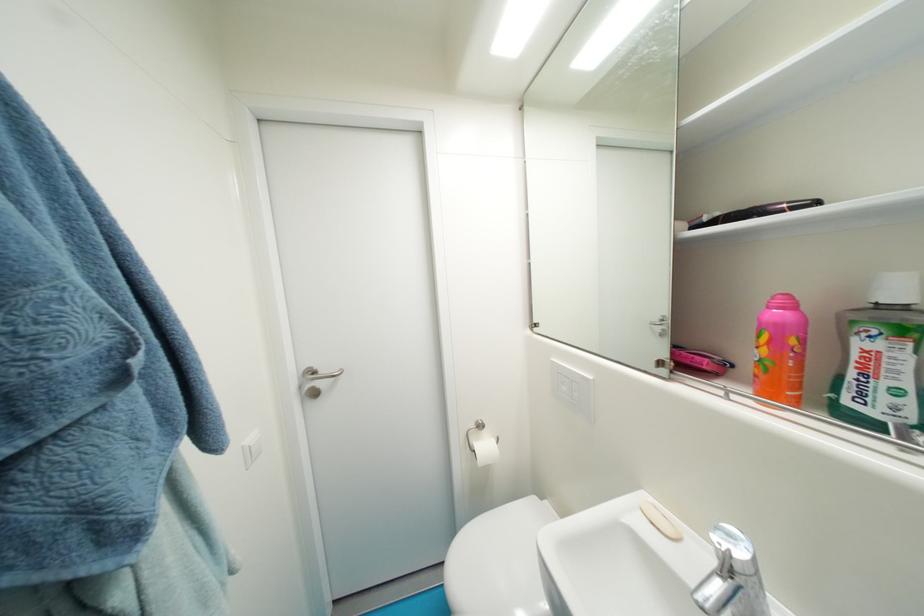
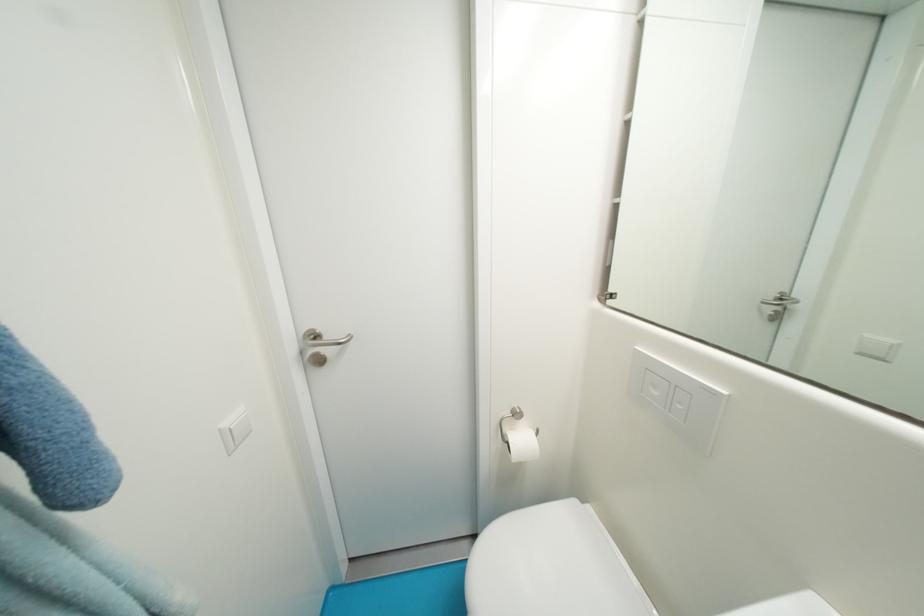
Question: What movement of the cameraman would produce the second image?

Choices:
 (A) Left
 (B) Right
 (C) Forward
 (D) Backward

Answer: (C)